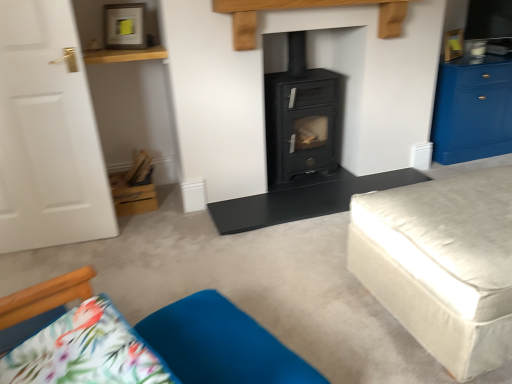
You are a GUI agent. You are given a task and a screenshot of the screen. Output one action in this format:
    pyautogui.click(x=<x>, y=<y>)
    Task: Click on the free space to the back side of velvety blue cushion at lower center
    This screenshot has width=512, height=384.
    Given the screenshot: What is the action you would take?
    click(250, 292)